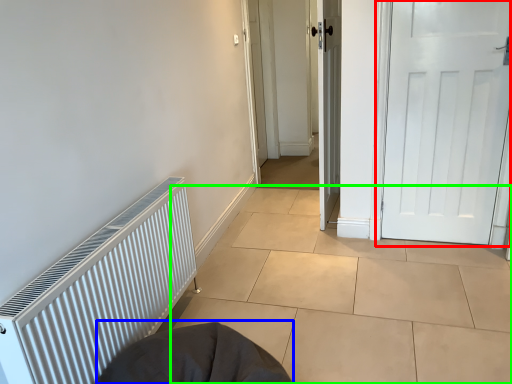
Question: Which object is the farthest from door (highlighted by a red box)? Choose among these: sleeping bag (highlighted by a blue box) or tile (highlighted by a green box).

Choices:
 (A) sleeping bag
 (B) tile

Answer: (A)